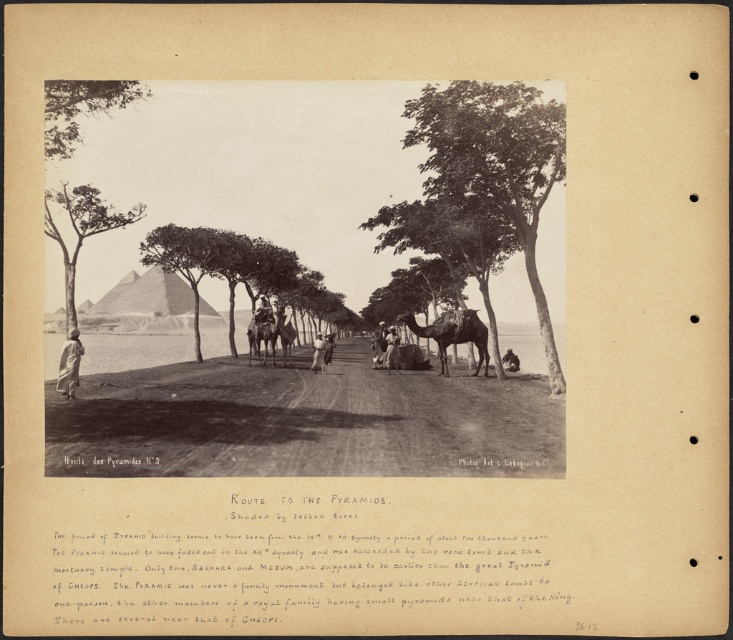
You are standing at the starting point of the Route to the Pyramids. You see two points marked on your map. The first point is at coordinates point (259,333) and the second is at point (320,365). If you want to reach the second point first before the first one, which direction should you walk relative to the path leading towards the pyramids?

To reach point (320,365) before point (259,333), you should walk along the path leading towards the pyramids since point (320,365) is in front of point (259,333) along the route.

In the scene shown: You are a tourist standing on the Route to the Pyramids. You see a green leafy tree at center and a light brown leather jacket at center. Which object is higher up in the scene?

The green leafy tree at center is positioned over the light brown leather jacket at center, so the tree is higher up in the scene.

You are standing at the point labeled point (559, 124) and want to walk towards the point labeled point (320, 348). Given that the path between them is along the dirt path lined with trees, will you be moving towards or away from the pyramids in the background?

Since point (559, 124) is closer to the camera than point (320, 348), moving from point (559, 124) to point (320, 348) means you are moving away from the pyramids in the background.